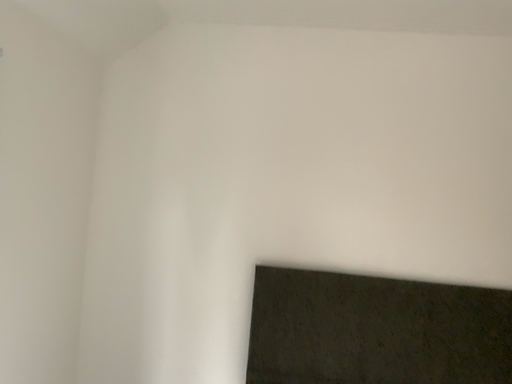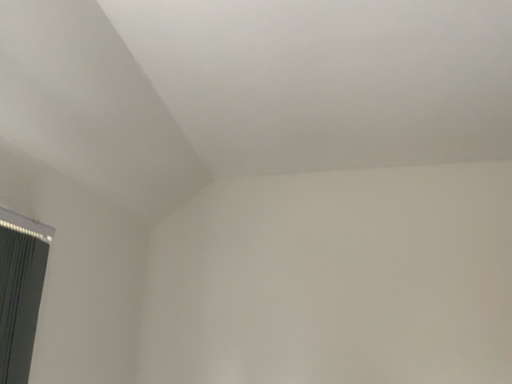
Question: How did the camera likely rotate when shooting the video?

Choices:
 (A) rotated upward
 (B) rotated downward

Answer: (A)